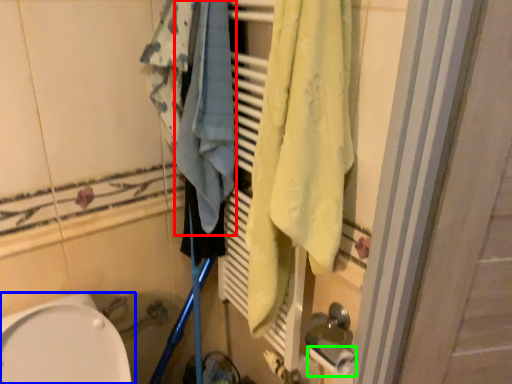
Question: Considering the real-world distances, which object is closest to bath towel (highlighted by a red box)? toilet (highlighted by a blue box) or toilet paper (highlighted by a green box).

Choices:
 (A) toilet
 (B) toilet paper

Answer: (A)